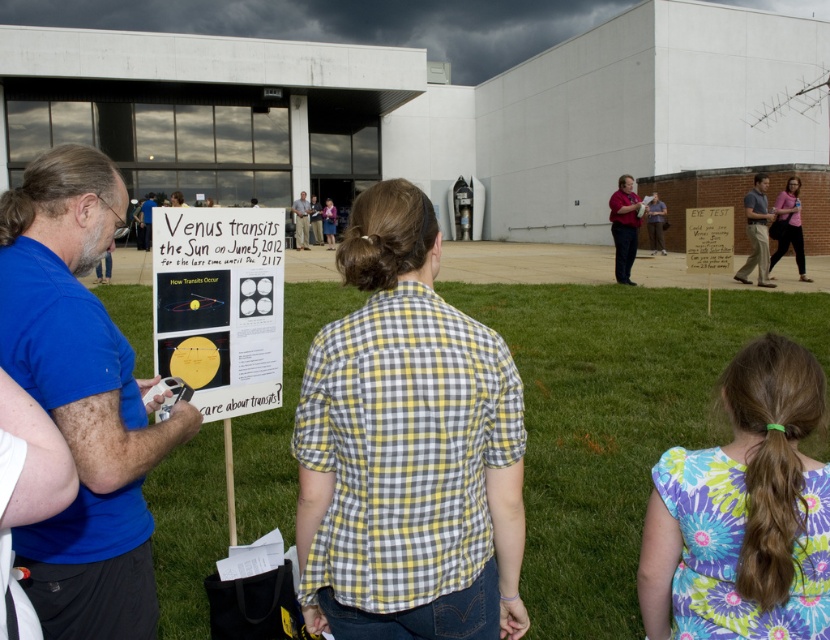
You are standing at the point with coordinates point (764,216) and want to walk to the point with coordinates point (619,208). Is the destination in front of or behind you?

The destination point (619,208) is behind you because it is located behind point (764,216) where you are standing.

You are standing at the event and want to take a photo of the matte red shirt at center without getting too close. If your camera has a maximum zoom range of 10 meters, can you capture a clear image from your current position?

The matte red shirt at center is 14.00 meters away from the viewer. Since the camera can only zoom up to 10 meters, you cannot capture a clear image without moving closer.